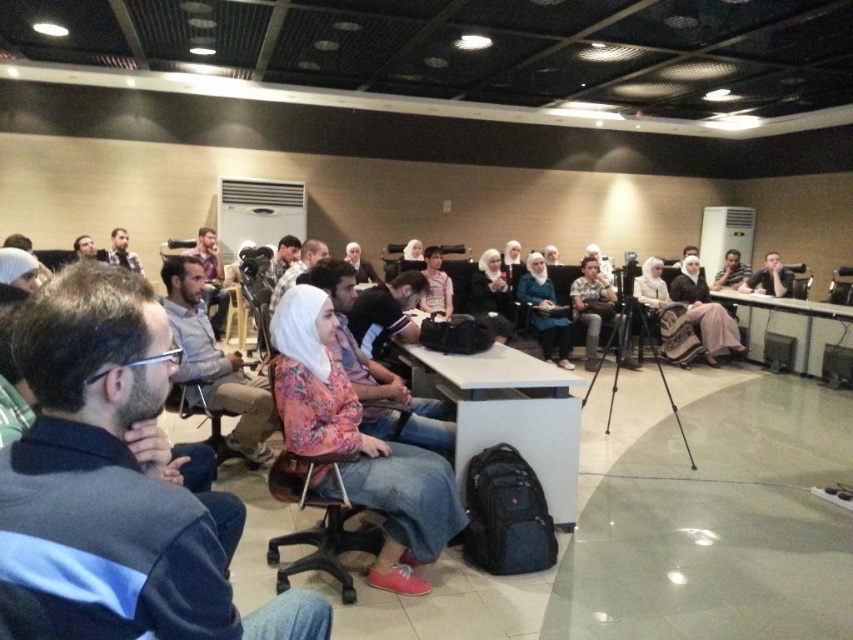
This screenshot has width=853, height=640. Identify the location of black plastic chair at center. (317, 524).

Looking at this image, is black plastic chair at center thinner than matte black laptop at upper right?

No.

Which is behind, point (268, 365) or point (764, 268)?

The point (764, 268) is more distant.

You are a GUI agent. You are given a task and a screenshot of the screen. Output one action in this format:
    pyautogui.click(x=<x>, y=<y>)
    Task: Click on the black plastic chair at center
    
    Given the screenshot: What is the action you would take?
    pyautogui.click(x=317, y=524)

Image resolution: width=853 pixels, height=640 pixels. Find the location of `matte gray shirt at center`. matte gray shirt at center is located at coordinates (213, 364).

Can you confirm if matte gray shirt at center is positioned to the right of matte black laptop at upper right?

No, matte gray shirt at center is not to the right of matte black laptop at upper right.

You are a GUI agent. You are given a task and a screenshot of the screen. Output one action in this format:
    pyautogui.click(x=<x>, y=<y>)
    Task: Click on the matte gray shirt at center
    
    Given the screenshot: What is the action you would take?
    pyautogui.click(x=213, y=364)

Where is `matte gray shirt at center`? Image resolution: width=853 pixels, height=640 pixels. matte gray shirt at center is located at coordinates (213, 364).

In the scene shown: Does matte gray shirt at center have a lesser height compared to matte black camera at center?

Indeed, matte gray shirt at center has a lesser height compared to matte black camera at center.

Does matte gray shirt at center appear under matte black camera at center?

Indeed, matte gray shirt at center is positioned under matte black camera at center.

Consider the image. Who is more distant from viewer, (265, 388) or (604, 320)?

The point (604, 320) is behind.

Locate an element on the screen. This screenshot has height=640, width=853. matte gray shirt at center is located at coordinates (213, 364).